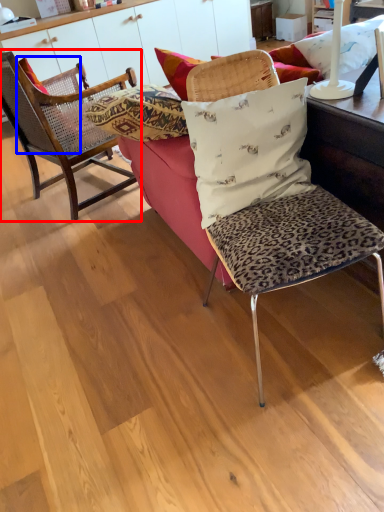
Question: Which point is further to the camera, chair (highlighted by a red box) or pillow (highlighted by a blue box)?

Choices:
 (A) chair
 (B) pillow

Answer: (B)